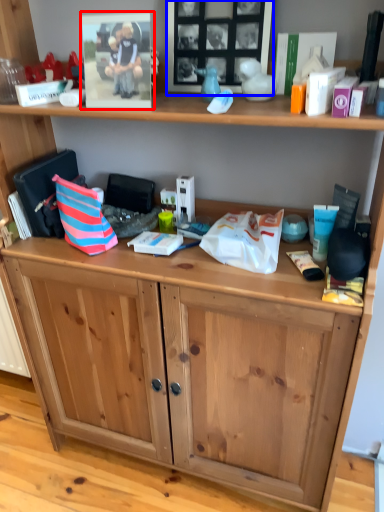
Question: Which point is closer to the camera, picture frame (highlighted by a red box) or picture frame (highlighted by a blue box)?

Choices:
 (A) picture frame
 (B) picture frame

Answer: (A)